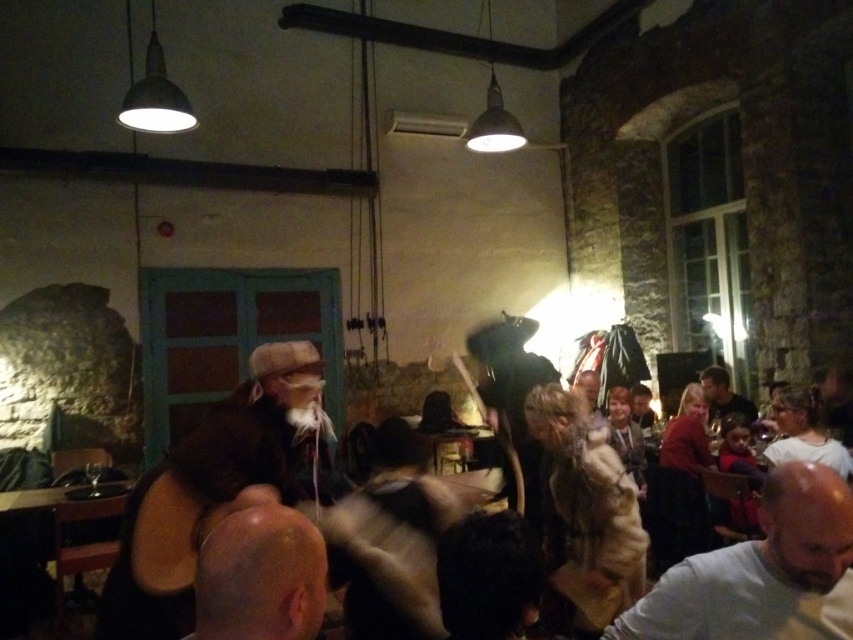
Question: Which object is farther from the camera taking this photo?

Choices:
 (A) dark brown leather jacket at right
 (B) brown leather jacket at center
 (C) gray matte shirt at lower right
 (D) smooth brown leather jacket at center

Answer: (D)

Question: Which object appears closest to the camera in this image?

Choices:
 (A) brown leather jacket at center
 (B) smooth brown leather jacket at center
 (C) fuzzy beige robe at center

Answer: (A)

Question: From the image, what is the correct spatial relationship of brown leather jacket at center in relation to bald head at lower left?

Choices:
 (A) below
 (B) above

Answer: (A)

Question: Which point appears farthest from the camera in this image?

Choices:
 (A) (619, 579)
 (B) (242, 556)
 (C) (581, 385)
 (D) (140, 637)

Answer: (C)

Question: Observing the image, what is the correct spatial positioning of fuzzy beige robe at center in reference to smooth brown leather jacket at center?

Choices:
 (A) left
 (B) right

Answer: (A)

Question: In this image, where is brown leather jacket at center located relative to fuzzy beige robe at center?

Choices:
 (A) below
 (B) above

Answer: (B)